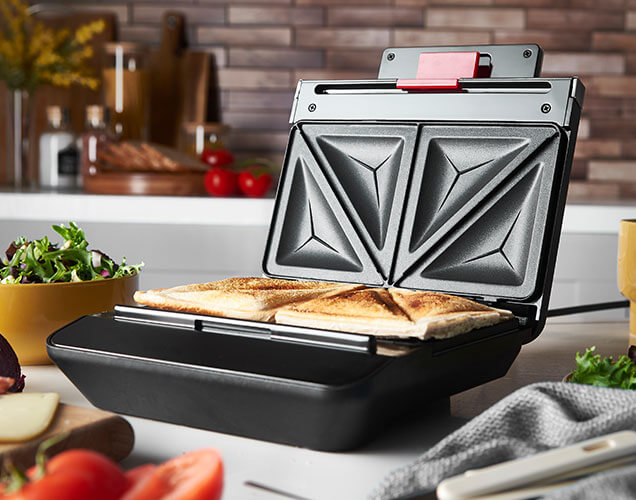
Locate an element on the screen. This screenshot has width=636, height=500. black sandwich maker is located at coordinates (448, 237).